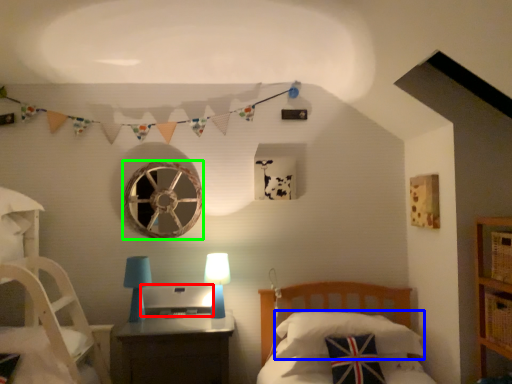
Question: Which object is positioned closest to desktop (highlighted by a red box)? Select from pillow (highlighted by a blue box) and oval (highlighted by a green box).

Choices:
 (A) pillow
 (B) oval

Answer: (B)